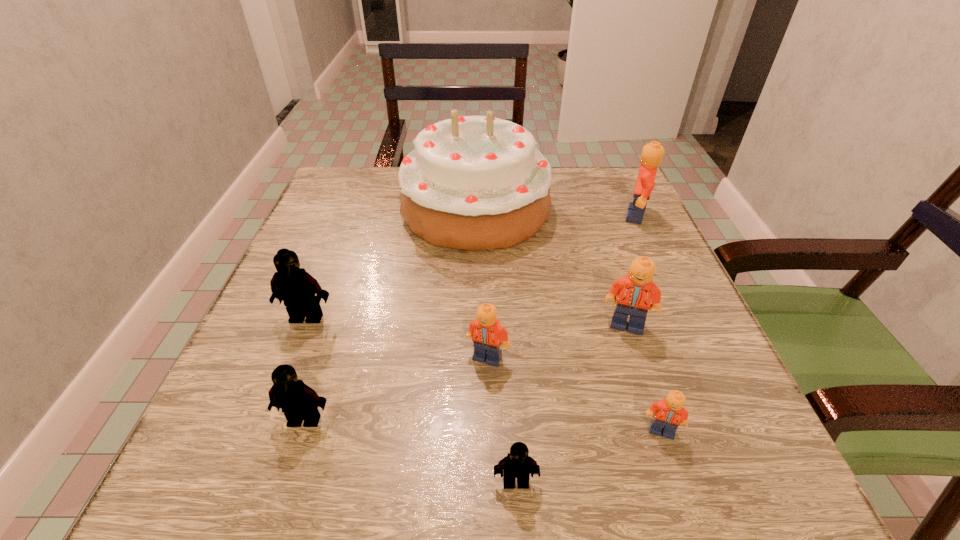
Find the location of a particular element. Image resolution: width=960 pixels, height=540 pixels. free space between the second farthest orange Lego and the nearest black Lego is located at coordinates (571, 403).

Identify the location of free spot between the third farthest orange Lego and the biggest orange Lego. The image size is (960, 540). (562, 287).

The height and width of the screenshot is (540, 960). I want to click on vacant region between the fourth nearest Lego and the rightmost black Lego, so click(x=501, y=420).

Where is `free space between the smallest orange Lego and the nearest Lego`? free space between the smallest orange Lego and the nearest Lego is located at coordinates (588, 456).

The height and width of the screenshot is (540, 960). Find the location of `free spot between the second smallest black Lego and the leftmost orange Lego`. free spot between the second smallest black Lego and the leftmost orange Lego is located at coordinates (396, 388).

At what (x,y) coordinates should I click in order to perform the action: click on empty space that is in between the third nearest orange Lego and the smallest orange Lego. Please return your answer as a coordinate pair (x, y). Looking at the image, I should click on (644, 378).

At what (x,y) coordinates should I click in order to perform the action: click on free space between the rightmost black Lego and the second farthest black Lego. Please return your answer as a coordinate pair (x, y). Looking at the image, I should click on (410, 450).

Identify the location of free space between the nearest Lego and the smallest orange Lego. (588, 456).

Find the location of a particular element. The height and width of the screenshot is (540, 960). empty space between the cake and the biggest black Lego is located at coordinates (392, 262).

Identify the location of empty location between the third smallest orange Lego and the smallest orange Lego. (644, 378).